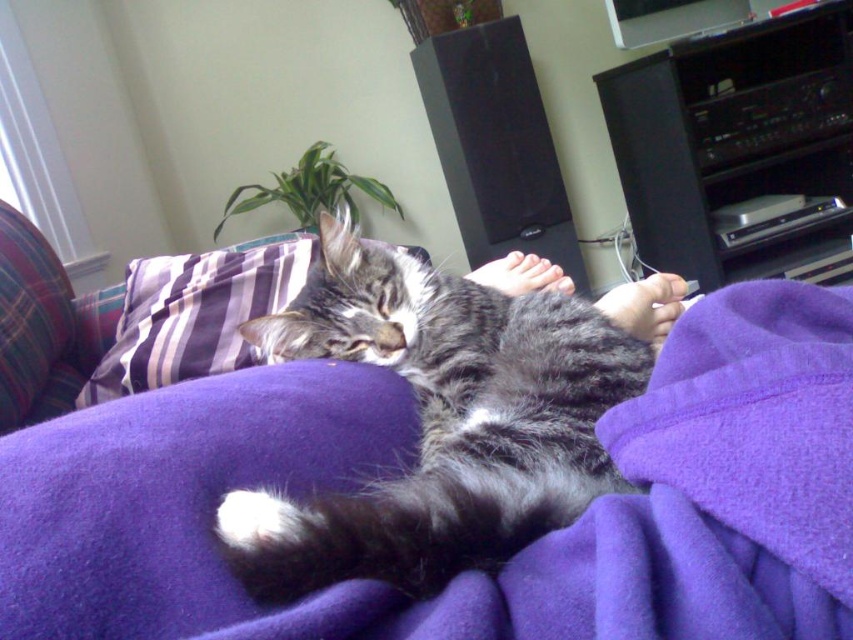
Question: Is purple fleece blanket at center wider than gray tabby cat at center?

Choices:
 (A) no
 (B) yes

Answer: (B)

Question: Which point is farther from the camera taking this photo?

Choices:
 (A) (627, 488)
 (B) (192, 276)
 (C) (527, 596)

Answer: (B)

Question: Is gray tabby cat at center above purple striped pillow at upper left?

Choices:
 (A) no
 (B) yes

Answer: (A)

Question: Which point is closer to the camera?

Choices:
 (A) (213, 627)
 (B) (486, 470)
 (C) (143, 282)

Answer: (A)

Question: Among these objects, which one is farthest from the camera?

Choices:
 (A) purple fleece blanket at center
 (B) gray tabby cat at center
 (C) purple striped pillow at upper left

Answer: (C)

Question: Considering the relative positions of purple fleece blanket at center and gray tabby cat at center in the image provided, where is purple fleece blanket at center located with respect to gray tabby cat at center?

Choices:
 (A) right
 (B) left

Answer: (A)